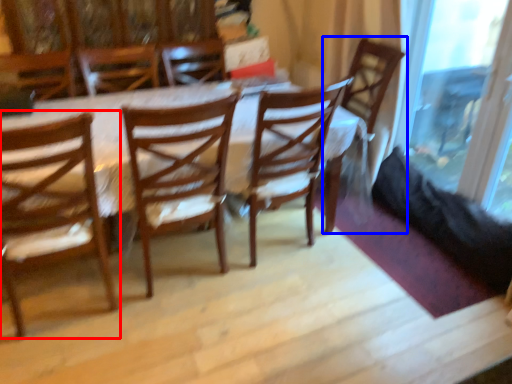
Question: Which object appears closest to the camera in this image, chair (highlighted by a red box) or chair (highlighted by a blue box)?

Choices:
 (A) chair
 (B) chair

Answer: (A)